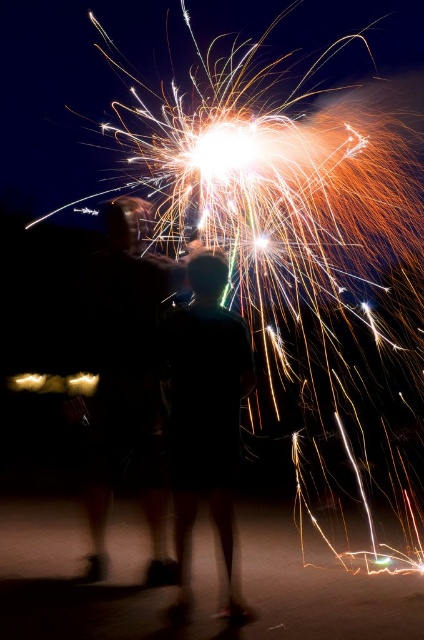
You are a photographer trying to capture the fireworks display. You notice the black matte couple at center and the black matte shirt at center in your frame. Which object should you focus on to ensure the larger subject is in sharp focus?

You should focus on the black matte couple at center because it is larger than the black matte shirt at center, making it the more prominent subject in the frame.

You are a photographer who wants to capture a photo of the black matte couple at center and the black matte shirt at center. You need to ensure that both subjects are in focus. Given that your camera has a depth of field that can cover 20 inches, will both subjects be in focus?

The black matte couple at center and black matte shirt at center are 20.17 inches apart from each other. Since the depth of field can only cover 20 inches, the distance between them exceeds the camera setting. Therefore, both subjects cannot be in focus simultaneously.